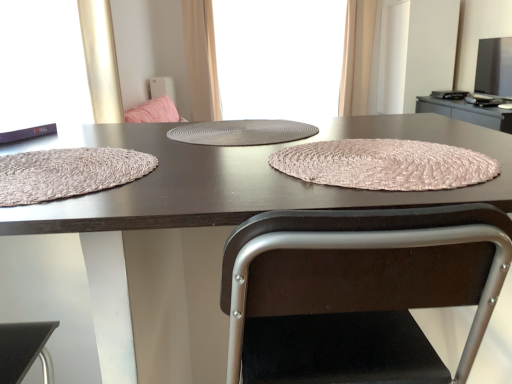
Find the location of `vacant space to the right of rustic woven placemat at left, the 2th blanket positioned from the right`. vacant space to the right of rustic woven placemat at left, the 2th blanket positioned from the right is located at coordinates (209, 179).